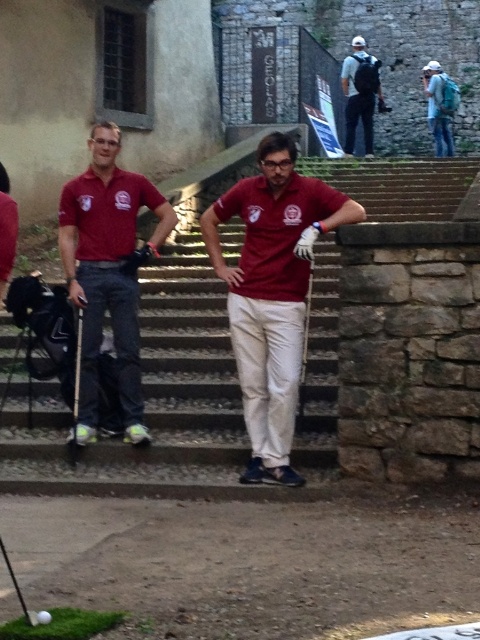
You are standing in front of the GEOLOGIA building and want to reach the two points marked in the image. Which point, point (348, 148) or point (432, 116), is closer to you?

Point (348, 148) is closer to the viewer than point (432, 116), so the closer point is point (348, 148).

Looking at this image, you are an observer standing in front of the stone steps where the two individuals are positioned. You notice the matte red polo shirt at center and the matte blue backpack at upper right. Which object appears taller from your perspective?

The matte red polo shirt at center appears taller than the matte blue backpack at upper right because the description states that the matte red polo shirt at center has a greater height compared to the matte blue backpack at upper right.

You are planning to carry both the matte gray backpack at upper right and the matte blue backpack at upper right while hiking. Considering their positions in the image, which backpack would require more horizontal space when placed side by side?

The matte gray backpack at upper right might be wider than matte blue backpack at upper right, so it would require more horizontal space when placed side by side.